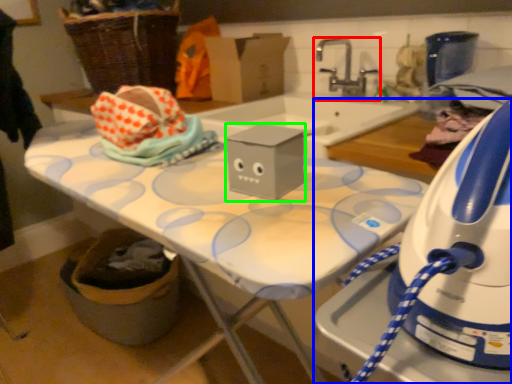
Question: Considering the real-world distances, which object is closest to tap (highlighted by a red box)? home appliance (highlighted by a blue box) or box (highlighted by a green box).

Choices:
 (A) home appliance
 (B) box

Answer: (B)